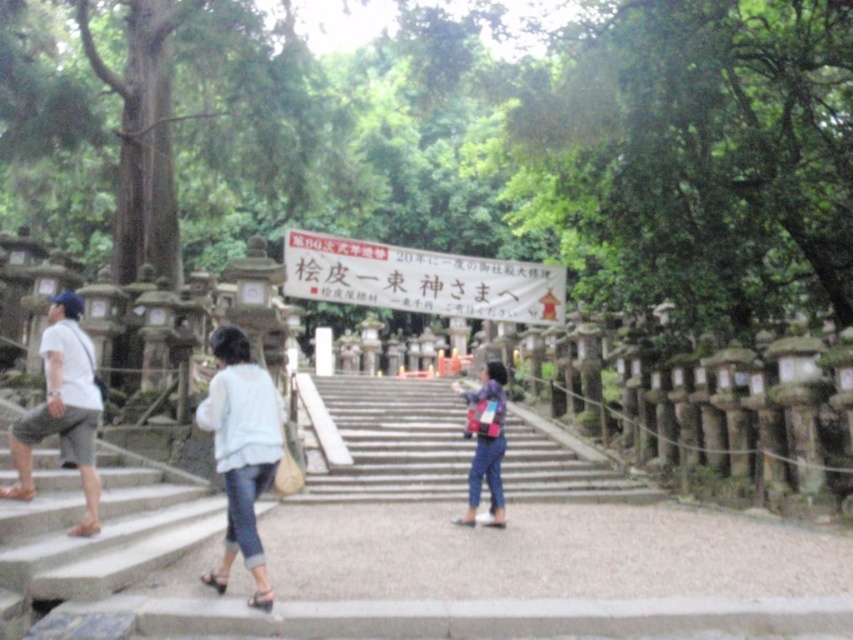
Question: Which point is closer to the camera taking this photo?

Choices:
 (A) [485, 364]
 (B) [409, 474]
 (C) [515, 280]
 (D) [242, 552]

Answer: (D)

Question: Does smooth concrete stairs at center appear on the left side of floral-patterned fabric bag at center?

Choices:
 (A) yes
 (B) no

Answer: (B)

Question: Which of the following is the closest to the observer?

Choices:
 (A) (90, 525)
 (B) (387, 404)

Answer: (A)

Question: In this image, where is white paper sign at center located relative to floral-patterned fabric bag at center?

Choices:
 (A) above
 (B) below

Answer: (A)

Question: Is white paper sign at center to the right of light blue denim jeans at lower left from the viewer's perspective?

Choices:
 (A) no
 (B) yes

Answer: (B)

Question: Which object appears closest to the camera in this image?

Choices:
 (A) smooth concrete stairs at center
 (B) white cotton shirt at left

Answer: (B)